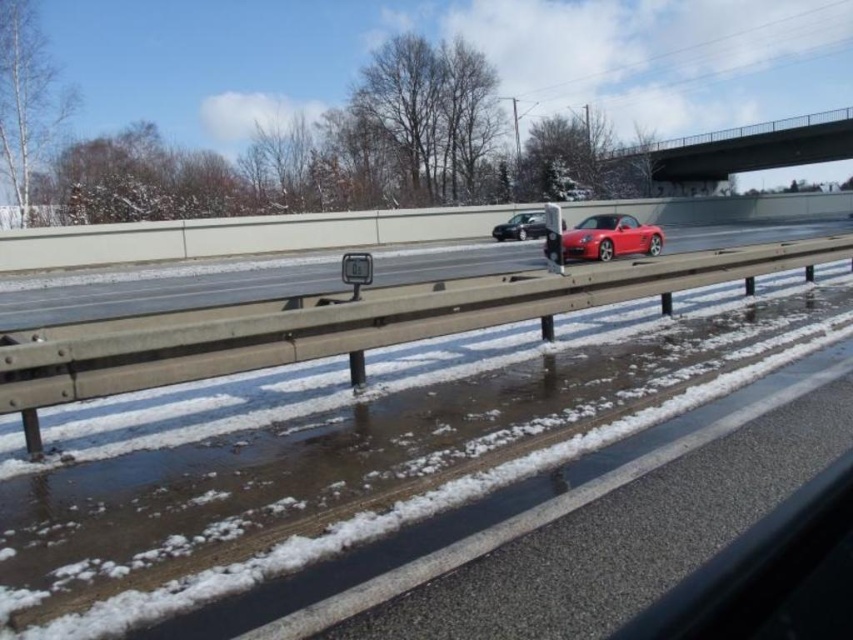
You are a passenger in the glossy red convertible at center. You notice a concrete bridge at upper center ahead. Can you safely drive under it without hitting the vehicle?

The concrete bridge at upper center is positioned over the glossy red convertible at center, so the convertible can safely drive under it without any collision risk.

Consider the image. You are a driver approaching the highway and see the concrete bridge at upper center and the satin black car at center. Which object is taller from your perspective?

The concrete bridge at upper center is much taller than the satin black car at center.